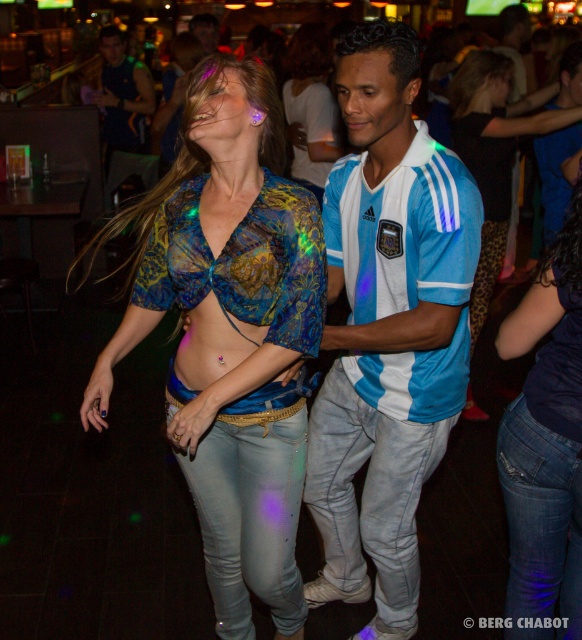
Is shiny blue fabric top at center wider than denim jeans at lower right?

Indeed, shiny blue fabric top at center has a greater width compared to denim jeans at lower right.

Locate an element on the screen. The image size is (582, 640). shiny blue fabric top at center is located at coordinates (230, 333).

Is point (239, 598) positioned after point (545, 602)?

Yes, it is.

Image resolution: width=582 pixels, height=640 pixels. I want to click on shiny blue fabric top at center, so click(230, 333).

Is denim jeans at lower right bigger than denim jeans at center?

No, denim jeans at lower right is not bigger than denim jeans at center.

Which is below, denim jeans at lower right or denim jeans at center?

Positioned lower is denim jeans at lower right.

Does point (517, 321) lie behind point (487, 205)?

No.

At what (x,y) coordinates should I click in order to perform the action: click on denim jeans at lower right. Please return your answer as a coordinate pair (x, y). Image resolution: width=582 pixels, height=640 pixels. Looking at the image, I should click on (545, 442).

Is point (219, 317) positioned in front of point (488, 198)?

Yes, it is.

Is the position of shiny blue fabric top at center less distant than that of denim jeans at center?

That is True.

Between point (196, 282) and point (453, 112), which one is positioned behind?

The point (453, 112) is more distant.

This screenshot has width=582, height=640. In order to click on shiny blue fabric top at center in this screenshot , I will do `click(230, 333)`.